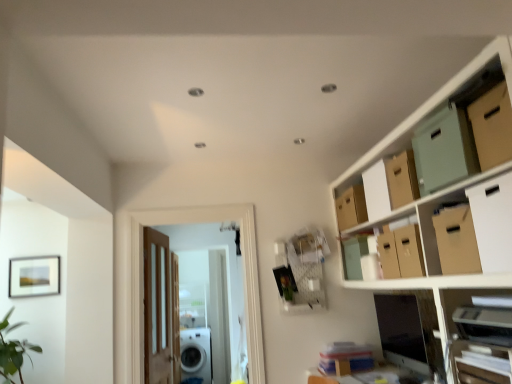
Question: Is white cardboard box at upper right, which appears as the first cardboard box when viewed from the front, positioned behind matte cardboard box at upper right, which is the 2th storage box from front to back?

Choices:
 (A) no
 (B) yes

Answer: (A)

Question: Considering the relative sizes of white cardboard box at upper right, which is the fourth cardboard box from back to front, and matte cardboard box at upper right, which is the 2th storage box from front to back, in the image provided, is white cardboard box at upper right, which is the fourth cardboard box from back to front, smaller than matte cardboard box at upper right, which is the 2th storage box from front to back,?

Choices:
 (A) no
 (B) yes

Answer: (A)

Question: Is white cardboard box at upper right, which appears as the first cardboard box when viewed from the front, facing away from matte cardboard box at upper right, the 1th storage box when ordered from back to front?

Choices:
 (A) yes
 (B) no

Answer: (B)

Question: Could you tell me if white cardboard box at upper right, which appears as the first cardboard box when viewed from the front, is turned towards matte cardboard box at upper right, the 1th storage box when ordered from back to front?

Choices:
 (A) no
 (B) yes

Answer: (A)

Question: Is white cardboard box at upper right, which appears as the first cardboard box when viewed from the front, completely or partially outside of matte cardboard box at upper right, which is the 2th storage box from front to back?

Choices:
 (A) yes
 (B) no

Answer: (A)

Question: From a real-world perspective, is matte cardboard boxes at upper right positioned above or below wooden door at center, which is the 1th door in front-to-back order?

Choices:
 (A) above
 (B) below

Answer: (A)

Question: Is matte cardboard boxes at upper right wider or thinner than wooden door at center, the 2th door positioned from the left?

Choices:
 (A) wide
 (B) thin

Answer: (A)

Question: Considering the positions of matte cardboard boxes at upper right and wooden door at center, which appears as the first door when viewed from the right, in the image, is matte cardboard boxes at upper right taller or shorter than wooden door at center, which appears as the first door when viewed from the right,?

Choices:
 (A) tall
 (B) short

Answer: (A)

Question: Which is correct: matte cardboard boxes at upper right is inside wooden door at center, the 2th door positioned from the left, or outside of it?

Choices:
 (A) outside
 (B) inside

Answer: (A)

Question: Relative to white cardboard box at upper right, which appears as the first cardboard box when viewed from the front, is matte cardboard boxes at upper right in front or behind?

Choices:
 (A) behind
 (B) front

Answer: (B)

Question: Considering the positions of matte cardboard boxes at upper right and white cardboard box at upper right, which is the fourth cardboard box from back to front, in the image, is matte cardboard boxes at upper right taller or shorter than white cardboard box at upper right, which is the fourth cardboard box from back to front,?

Choices:
 (A) short
 (B) tall

Answer: (B)

Question: Looking at their shapes, would you say matte cardboard boxes at upper right is wider or thinner than white cardboard box at upper right, which is the fourth cardboard box from back to front?

Choices:
 (A) thin
 (B) wide

Answer: (B)

Question: Is matte cardboard boxes at upper right situated inside white cardboard box at upper right, which appears as the first cardboard box when viewed from the front, or outside?

Choices:
 (A) inside
 (B) outside

Answer: (B)

Question: Based on their sizes in the image, would you say white cardboard box at upper right, which is the fourth cardboard box from back to front, is bigger or smaller than wooden door at center, which is counted as the 2th door, starting from the back?

Choices:
 (A) big
 (B) small

Answer: (B)

Question: From their relative heights in the image, would you say white cardboard box at upper right, which appears as the first cardboard box when viewed from the front, is taller or shorter than wooden door at center, which appears as the first door when viewed from the right?

Choices:
 (A) short
 (B) tall

Answer: (A)